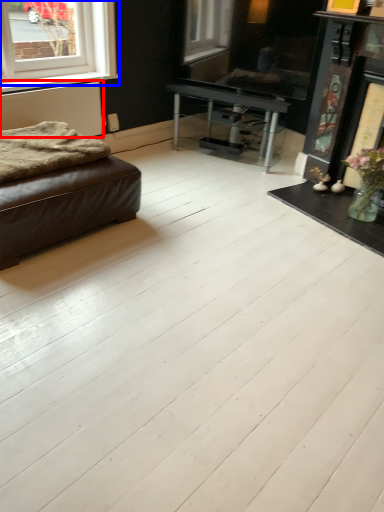
Question: Among these objects, which one is farthest to the camera, radiator (highlighted by a red box) or window (highlighted by a blue box)?

Choices:
 (A) radiator
 (B) window

Answer: (A)